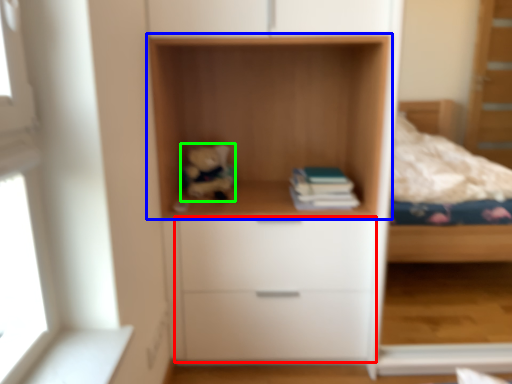
Question: Which object is the farthest from drawer (highlighted by a red box)? Choose among these: shelf (highlighted by a blue box) or toy (highlighted by a green box).

Choices:
 (A) shelf
 (B) toy

Answer: (B)